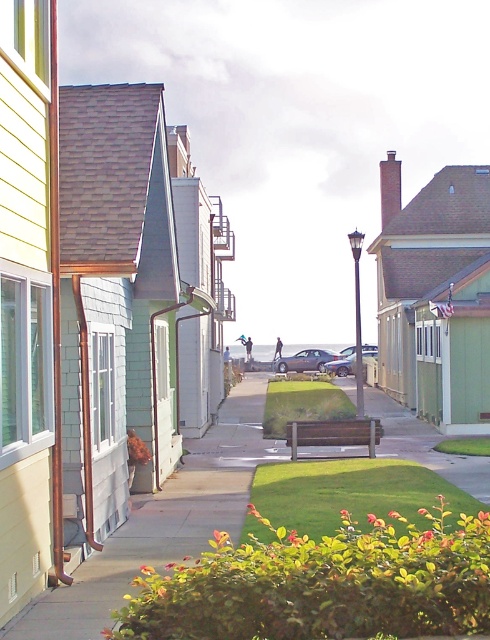
You are a delivery person who needs to park your vehicle on the concrete sidewalk at center. The city has a rule that the vehicle must be shorter than the sidewalk. Can you safely park your satin silver sedan at center there?

The concrete sidewalk at center is shorter than the satin silver sedan at center, so the sedan cannot be parked there as it would exceed the sidewalk length requirement.

You are standing on the concrete sidewalk at center and want to get to the metallic silver sedan at center. Which direction should you move to reach it?

The concrete sidewalk at center is closer to the viewer than the metallic silver sedan at center, so you should move backward to reach the metallic silver sedan at center.

Based on the photo, you are a delivery person trying to park your vehicle on the concrete sidewalk at center. However, there is a satin silver sedan at center already occupying the space. Based on the scene description, can you park your vehicle there without blocking the sedan?

The concrete sidewalk at center is positioned under the satin silver sedan at center, which means the sedan is parked on the sidewalk. Since the sedan is already occupying the space, you cannot park your vehicle there without blocking it.